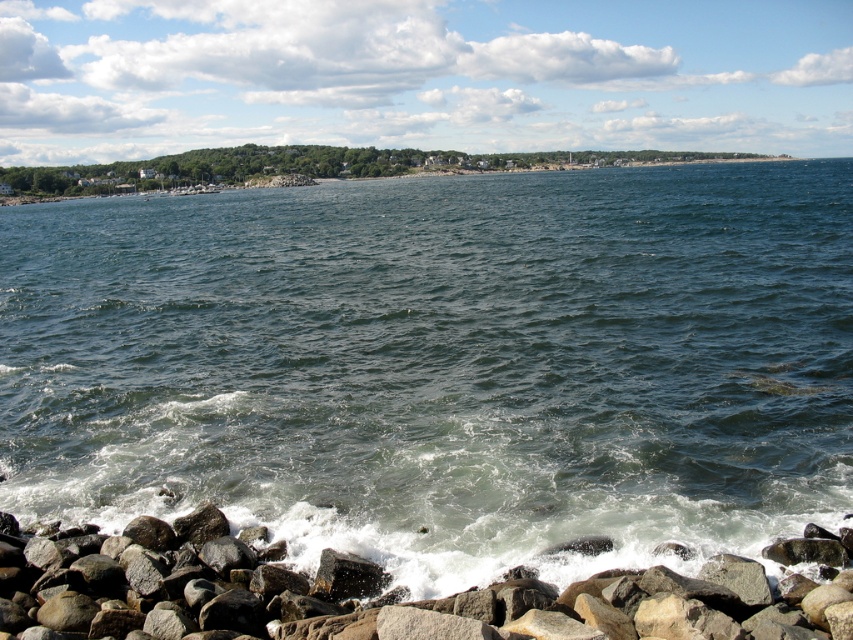
Who is more distant from viewer, [695,330] or [219,592]?

Positioned behind is point [695,330].

Does dark blue water at center appear over gray rock at lower left?

Indeed, dark blue water at center is positioned over gray rock at lower left.

Does point (845, 410) lie behind point (317, 580)?

Yes, point (845, 410) is farther from viewer.

Locate an element on the screen. Image resolution: width=853 pixels, height=640 pixels. dark blue water at center is located at coordinates (442, 364).